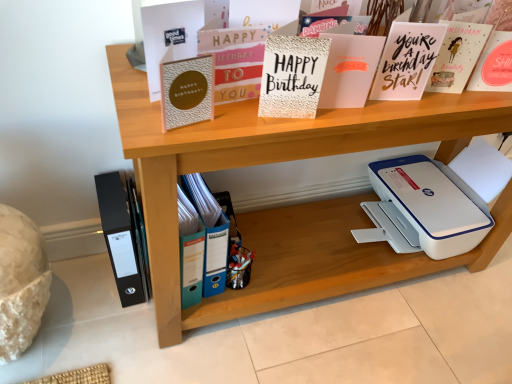
Identify the location of vacant space in front of matte pink card at upper right, positioned as the seventh paperback book in left-to-right order. (430, 107).